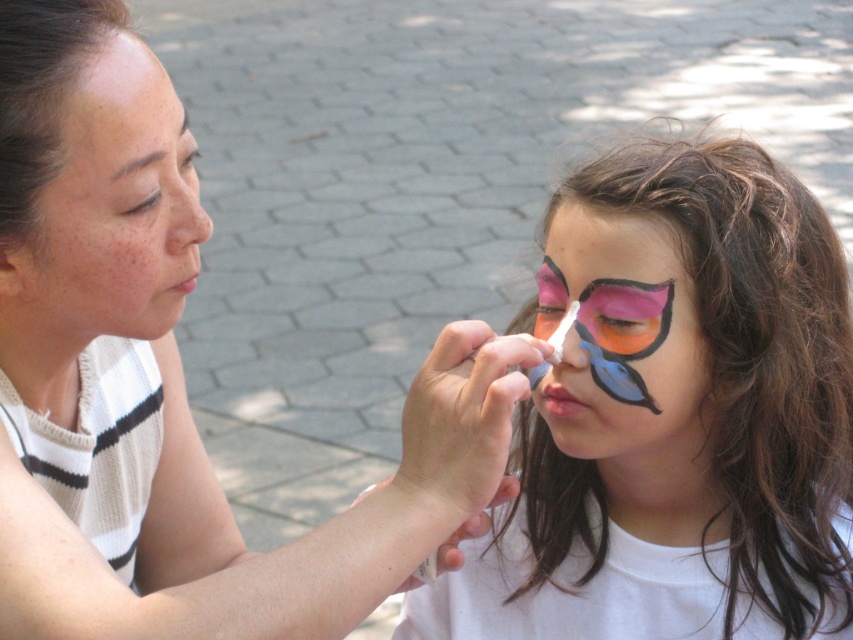
Question: Which object appears farthest from the camera in this image?

Choices:
 (A) matte skin nose at upper center
 (B) matte black eye at upper center
 (C) matte pink paint at center

Answer: (C)

Question: Which point is farther to the camera?

Choices:
 (A) coord(148,637)
 (B) coord(624,493)

Answer: (B)

Question: Can you confirm if matte skin nose at upper center is positioned above pink matte eye at center?

Choices:
 (A) yes
 (B) no

Answer: (A)

Question: Which object appears closest to the camera in this image?

Choices:
 (A) matte skin nose at upper center
 (B) matte pink paint at center

Answer: (A)

Question: Is matte pink paint at center to the left of pink matte eye at center from the viewer's perspective?

Choices:
 (A) no
 (B) yes

Answer: (B)

Question: Does pink matte eye at center lie behind matte pink paint at upper center?

Choices:
 (A) no
 (B) yes

Answer: (A)